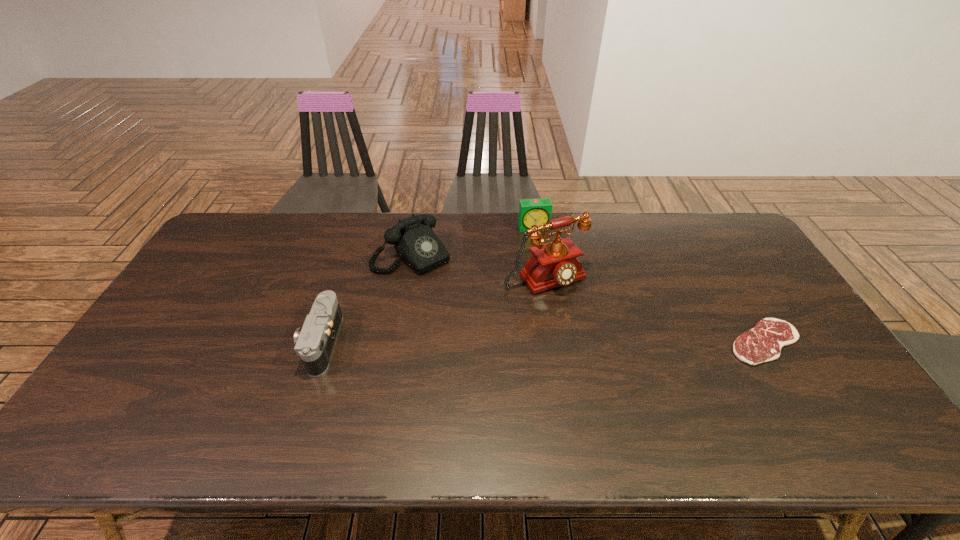
Find the location of a particular element. The height and width of the screenshot is (540, 960). vacant spot on the desktop that is between the camera and the steak and is positioned on the dial of the second object from left to right is located at coordinates click(x=499, y=342).

At what (x,y) coordinates should I click in order to perform the action: click on vacant space on the desktop that is between the camera and the rightmost object and is positioned on the front-facing side of the alarm clock. Please return your answer as a coordinate pair (x, y). Looking at the image, I should click on (569, 342).

What are the coordinates of `free spot on the desktop that is between the camera and the rightmost object and is positioned on the dial of the right telephone` in the screenshot? It's located at pyautogui.click(x=593, y=342).